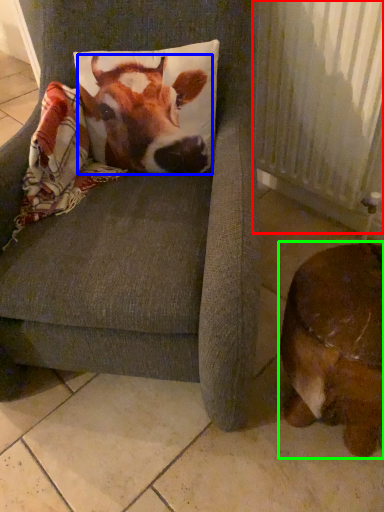
Question: Considering the real-world distances, which object is farthest from radiator (highlighted by a red box)? cattle (highlighted by a blue box) or dog (highlighted by a green box)?

Choices:
 (A) cattle
 (B) dog

Answer: (B)